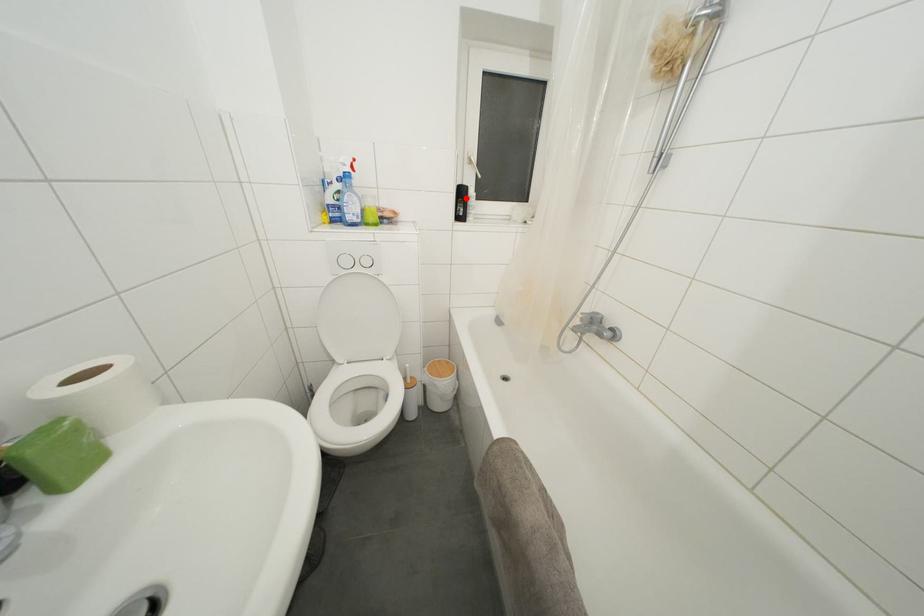
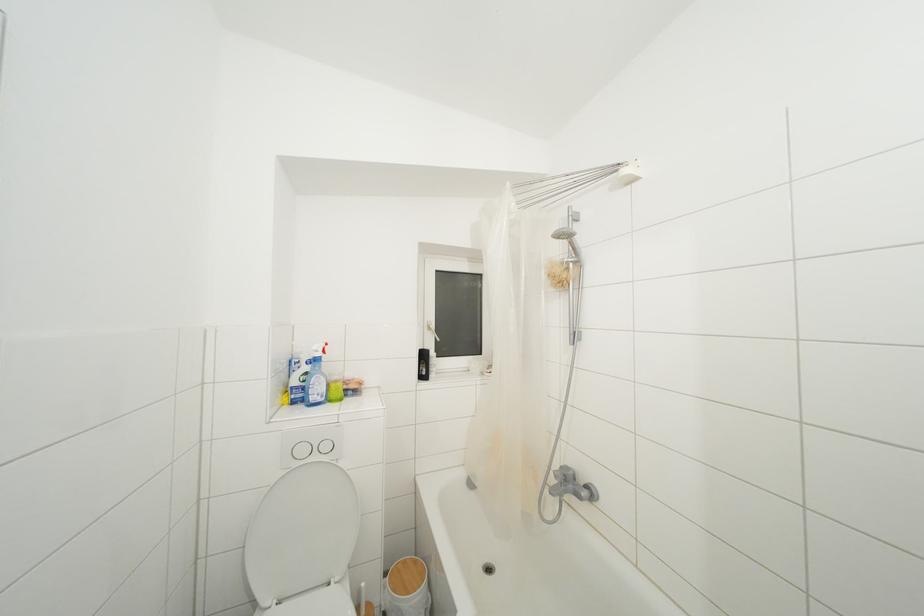
Question: I am providing you with two images of the same scene from different viewpoints. Given a red point in image1, look at the same physical point in image2. Is it:

Choices:
 (A) Closer to the viewpoint
 (B) Farther from the viewpoint

Answer: (B)